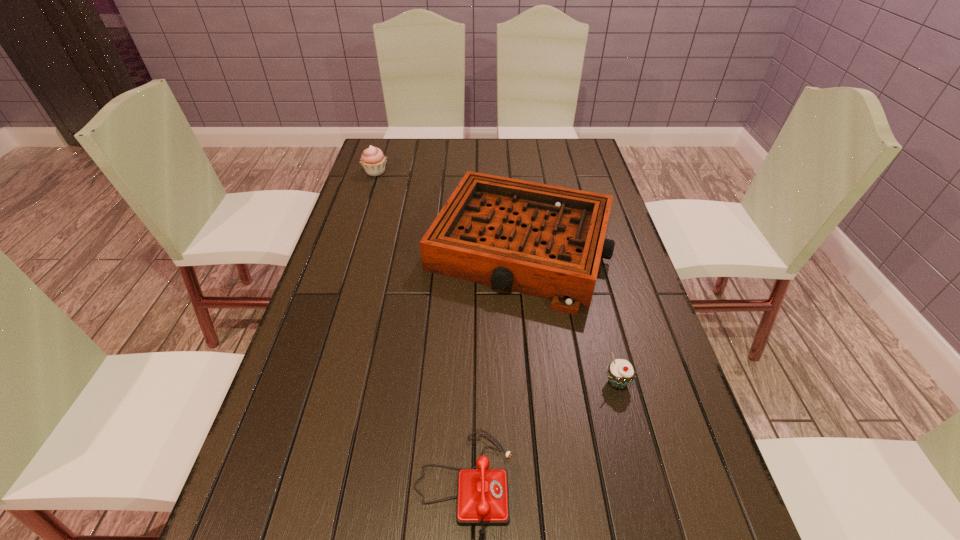
Where is `unoccupied area between the gameboard and the nearer cupcake`? unoccupied area between the gameboard and the nearer cupcake is located at coordinates (569, 315).

Locate which object ranks second in proximity to the telephone. Please provide its 2D coordinates. Your answer should be formatted as a tuple, i.e. [(x, y)], where the tuple contains the x and y coordinates of a point satisfying the conditions above.

[(546, 241)]

You are a GUI agent. You are given a task and a screenshot of the screen. Output one action in this format:
    pyautogui.click(x=<x>, y=<y>)
    Task: Click on the object that is the second nearest to the right cupcake
    The width and height of the screenshot is (960, 540).
    Given the screenshot: What is the action you would take?
    pyautogui.click(x=482, y=495)